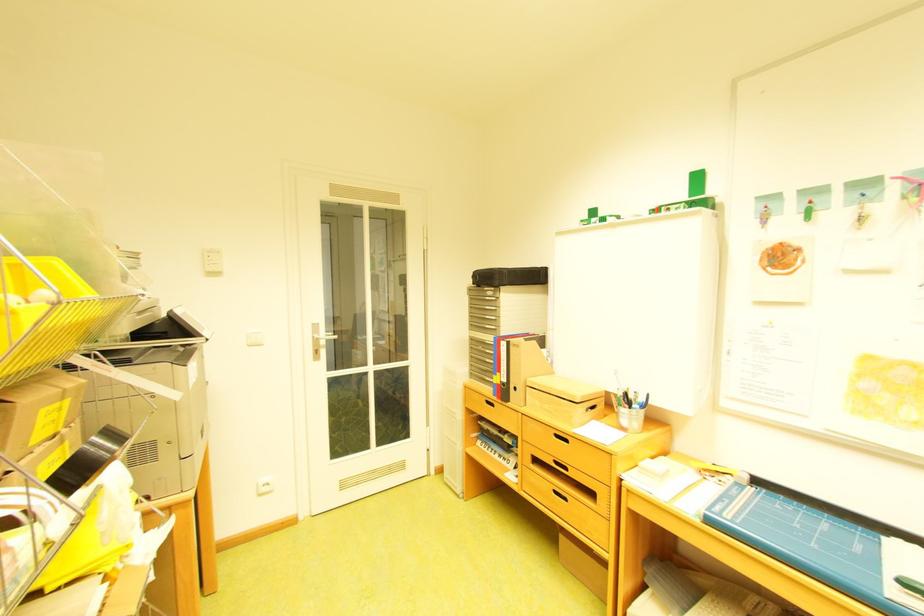
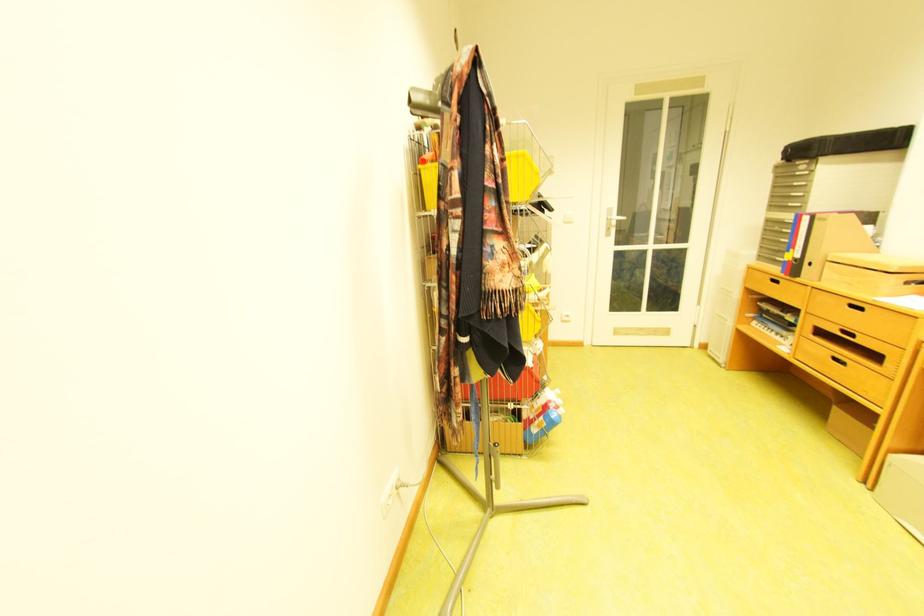
Find the pixel in the second image that matches (592,398) in the first image.

(910, 268)